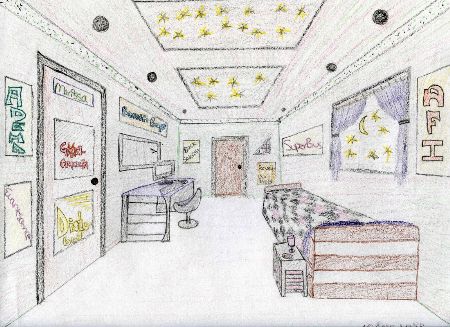
Locate an element on the screen. door is located at coordinates tap(68, 184).